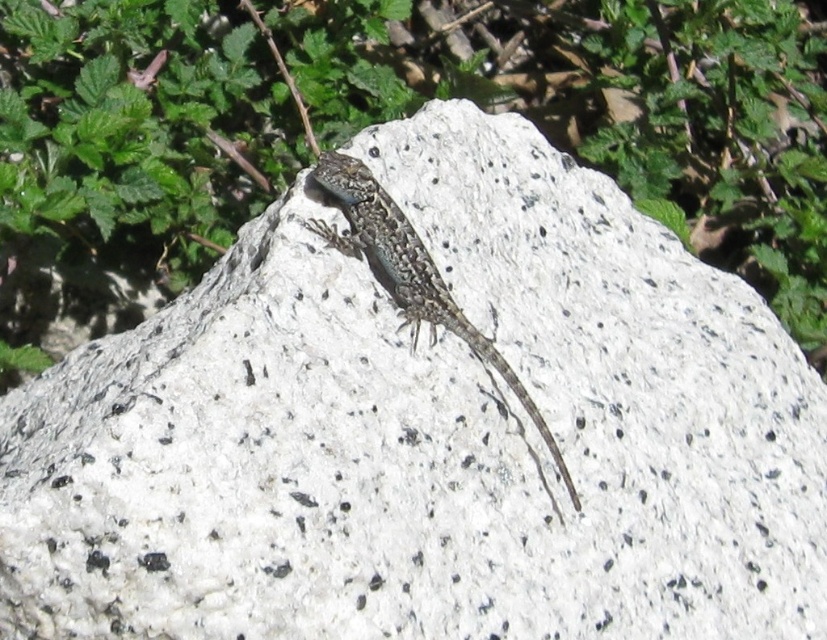
From the picture: You are a photographer trying to capture the speckled stone lizard at center. You want to ensure the green leafy plant at upper center doesn not block the lizard in your shot. Should you move your camera to the left or right to frame the lizard without the plant?

To avoid the green leafy plant at upper center blocking the speckled stone lizard at center, move your camera to the left. Since the plant is to the right of the lizard, moving left will shift the frame away from the plant, keeping the lizard centered while excluding the plant from the shot.

Based on the scene described, which object is taller between the green leafy plant at upper center and the speckled stone lizard at center?

The green leafy plant at upper center is much taller than the speckled stone lizard at center.

You are holding a camera and want to take a photo of the green leafy plant at upper center. If you are currently 1.44 meters away from the plant, is this a suitable distance for capturing the entire plant in the frame without moving closer or farther?

→ The distance between the green leafy plant at upper center and the camera is 1.44 meters. Whether this is suitable depends on the camera lens and sensor size. However, since the scene describes the plant as part of the background with green foliage slightly out of focus, it suggests that the current distance might already be optimal for focusing on the primary subject, the lizard and rock. Moving closer might disrupt the lizard. Therefore, maintaining the 1.44 meters distance is advisable to avoid intrusion